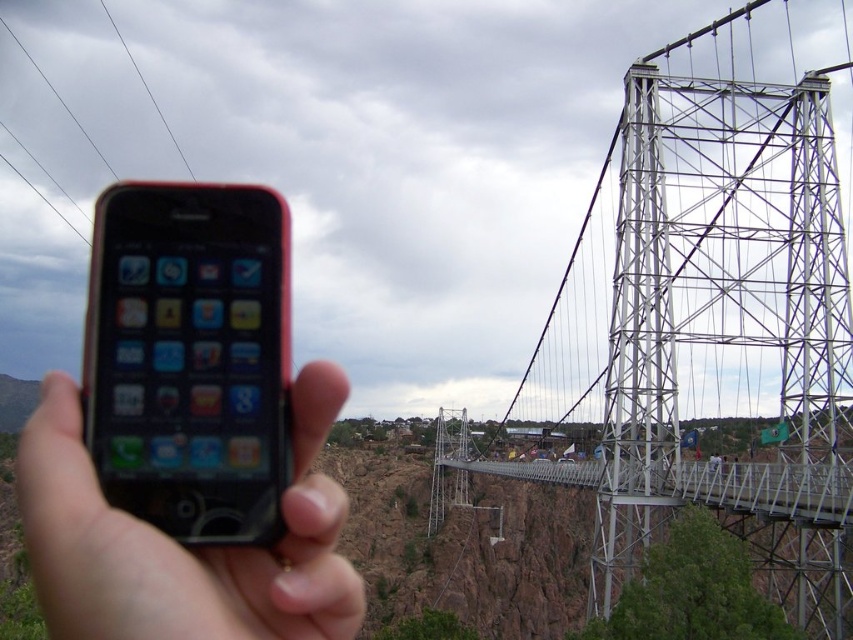
Does metallic silver suspension bridge at center have a lesser width compared to black wire at upper left?

No.

Consider the image. Does metallic silver suspension bridge at center have a greater width compared to black wire at upper left?

Correct, the width of metallic silver suspension bridge at center exceeds that of black wire at upper left.

Locate an element on the screen. metallic silver suspension bridge at center is located at coordinates (711, 317).

I want to click on metallic silver suspension bridge at center, so click(x=711, y=317).

Is black matte smartphone at left thinner than black matte phone at center?

Indeed, black matte smartphone at left has a lesser width compared to black matte phone at center.

Can you confirm if black matte smartphone at left is taller than black matte phone at center?

No.

What are the coordinates of `black matte smartphone at left` in the screenshot? It's located at (190, 356).

Where is `black matte smartphone at left`? The image size is (853, 640). black matte smartphone at left is located at coordinates (190, 356).

Between black matte smartphone at left and black wire at upper left, which one has less height?

Standing shorter between the two is black matte smartphone at left.

Does point (192, 266) come in front of point (129, 54)?

Yes, point (192, 266) is closer to viewer.

You are a GUI agent. You are given a task and a screenshot of the screen. Output one action in this format:
    pyautogui.click(x=<x>, y=<y>)
    Task: Click on the black matte smartphone at left
    
    Given the screenshot: What is the action you would take?
    pyautogui.click(x=190, y=356)